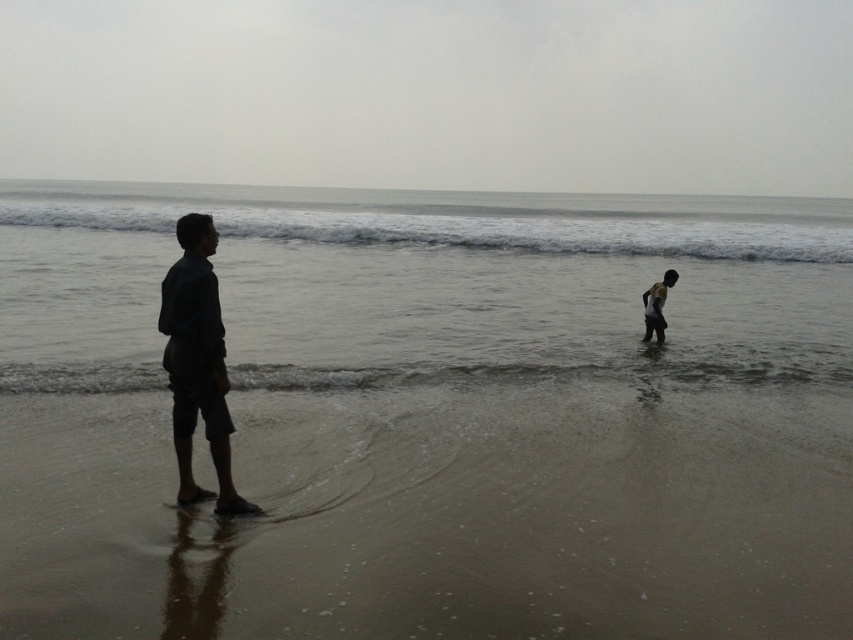
Question: Which is farther from the sandy beach at lower center?

Choices:
 (A) dark blue fabric shirt at left
 (B) dark skin child at lower right

Answer: (B)

Question: Considering the relative positions of clear water at center and dark skin child at lower right in the image provided, where is clear water at center located with respect to dark skin child at lower right?

Choices:
 (A) right
 (B) left

Answer: (A)

Question: Does sandy beach at lower center have a greater width compared to dark skin child at lower right?

Choices:
 (A) yes
 (B) no

Answer: (B)

Question: Which is farther from the clear water at center?

Choices:
 (A) dark blue fabric shirt at left
 (B) dark skin child at lower right

Answer: (B)

Question: Which object appears farthest from the camera in this image?

Choices:
 (A) dark skin child at lower right
 (B) sandy beach at lower center
 (C) clear water at center

Answer: (A)

Question: Is sandy beach at lower center above dark skin child at lower right?

Choices:
 (A) no
 (B) yes

Answer: (A)